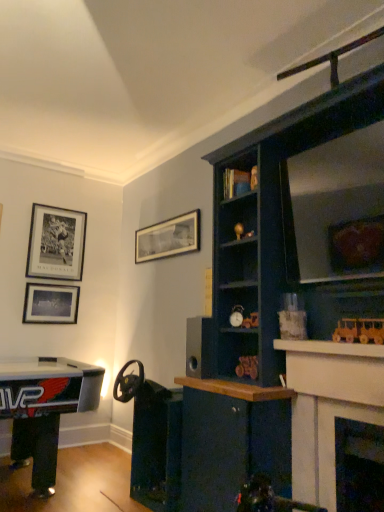
Question: Can you confirm if matte black alarm clock at center, the 4th toy when ordered from top to bottom, is smaller than white glossy fireplace at upper right, which is counted as the 2th fireplace, starting from the right?

Choices:
 (A) no
 (B) yes

Answer: (B)

Question: Considering the relative sizes of matte black alarm clock at center, which is counted as the first toy, starting from the left, and white glossy fireplace at upper right, acting as the 1th fireplace starting from the left, in the image provided, is matte black alarm clock at center, which is counted as the first toy, starting from the left, shorter than white glossy fireplace at upper right, acting as the 1th fireplace starting from the left,?

Choices:
 (A) no
 (B) yes

Answer: (B)

Question: Can you confirm if matte black alarm clock at center, arranged as the second toy when viewed from the back, is bigger than white glossy fireplace at upper right, which is counted as the 2th fireplace, starting from the right?

Choices:
 (A) no
 (B) yes

Answer: (A)

Question: Is matte black alarm clock at center, the 4th toy when ordered from top to bottom, surrounding white glossy fireplace at upper right, acting as the 1th fireplace starting from the left?

Choices:
 (A) yes
 (B) no

Answer: (B)

Question: Can you confirm if matte black alarm clock at center, which is counted as the first toy, starting from the left, is wider than white glossy fireplace at upper right, which is counted as the 2th fireplace, starting from the right?

Choices:
 (A) yes
 (B) no

Answer: (B)

Question: Is wooden figurine at upper center, arranged as the fourth toy when viewed from the left, situated inside white glossy fireplace at upper right, acting as the 1th fireplace starting from the left, or outside?

Choices:
 (A) inside
 (B) outside

Answer: (B)

Question: Is wooden figurine at upper center, marked as the 3th toy in a front-to-back arrangement, to the left or to the right of white glossy fireplace at upper right, which is counted as the 2th fireplace, starting from the right, in the image?

Choices:
 (A) left
 (B) right

Answer: (A)

Question: Relative to white glossy fireplace at upper right, which is counted as the 2th fireplace, starting from the right, is wooden figurine at upper center, marked as the 3th toy in a front-to-back arrangement, in front or behind?

Choices:
 (A) front
 (B) behind

Answer: (B)

Question: In terms of size, does wooden figurine at upper center, arranged as the first toy when viewed from the top, appear bigger or smaller than white glossy fireplace at upper right, acting as the 1th fireplace starting from the left?

Choices:
 (A) small
 (B) big

Answer: (A)

Question: From a real-world perspective, is wooden train at right, the third toy from the top, above or below metallic gold toy car at center-right, the fifth toy when ordered from top to bottom?

Choices:
 (A) below
 (B) above

Answer: (B)

Question: Based on their positions, is wooden train at right, the fifth toy when ordered from left to right, located to the left or right of metallic gold toy car at center-right, the fourth toy from the back?

Choices:
 (A) right
 (B) left

Answer: (A)

Question: Choose the correct answer: Is wooden train at right, the 3th toy ordered from the bottom, inside metallic gold toy car at center-right, the first toy from the bottom, or outside it?

Choices:
 (A) inside
 (B) outside

Answer: (B)

Question: Is point (382, 323) positioned closer to the camera than point (254, 364)?

Choices:
 (A) closer
 (B) farther

Answer: (A)

Question: Based on their positions, is black matte speaker at center located to the left or right of matte black picture frame at upper left, marked as the third picture frame in a right-to-left arrangement?

Choices:
 (A) right
 (B) left

Answer: (A)

Question: Is black matte speaker at center taller or shorter than matte black picture frame at upper left, positioned as the 1th picture frame in left-to-right order?

Choices:
 (A) tall
 (B) short

Answer: (A)